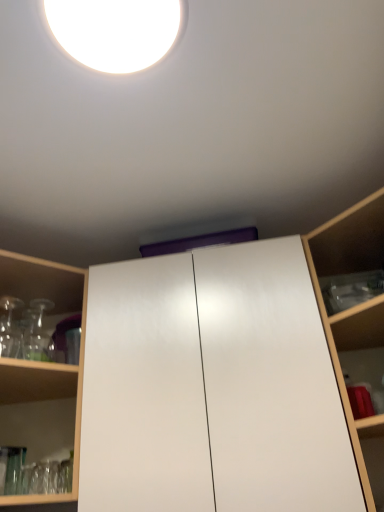
Describe the element at coordinates (115, 31) in the screenshot. I see `white glossy droplight at upper center` at that location.

Where is `wooden shelf at right, the 2th shelf when ordered from left to right`? wooden shelf at right, the 2th shelf when ordered from left to right is located at coordinates (352, 308).

Considering the relative positions of white glossy droplight at upper center and transparent glassware at left, arranged as the first shelf when viewed from the left, in the image provided, is white glossy droplight at upper center to the right of transparent glassware at left, arranged as the first shelf when viewed from the left, from the viewer's perspective?

Indeed, white glossy droplight at upper center is positioned on the right side of transparent glassware at left, arranged as the first shelf when viewed from the left.

Is white glossy droplight at upper center placed right next to transparent glassware at left, arranged as the first shelf when viewed from the left?

No.

In the scene shown: Looking at their sizes, would you say white glossy droplight at upper center is wider or thinner than transparent glassware at left, arranged as the first shelf when viewed from the left?

In the image, white glossy droplight at upper center appears to be more narrow than transparent glassware at left, arranged as the first shelf when viewed from the left.

In the image, is white glossy droplight at upper center positioned in front of or behind transparent glassware at left, the second shelf from the right?

In the image, white glossy droplight at upper center appears in front of transparent glassware at left, the second shelf from the right.

You are a GUI agent. You are given a task and a screenshot of the screen. Output one action in this format:
    pyautogui.click(x=<x>, y=<y>)
    Task: Click on the shelf above the transparent glassware at left, the second shelf from the right (from the image's perspective)
    
    Given the screenshot: What is the action you would take?
    pyautogui.click(x=352, y=308)

Which object is thinner, wooden shelf at right, the 1th shelf from the right, or transparent glassware at left, arranged as the first shelf when viewed from the left?

wooden shelf at right, the 1th shelf from the right, is thinner.

Does wooden shelf at right, the 1th shelf from the right, contain transparent glassware at left, arranged as the first shelf when viewed from the left?

No, wooden shelf at right, the 1th shelf from the right, does not contain transparent glassware at left, arranged as the first shelf when viewed from the left.

Is white glossy cabinet at center looking in the opposite direction of transparent glassware at left, the second shelf from the right?

white glossy cabinet at center does not have its back to transparent glassware at left, the second shelf from the right.

From the image's perspective, which object appears higher, white glossy cabinet at center or transparent glassware at left, the second shelf from the right?

white glossy cabinet at center appears higher in the image.

Is white glossy cabinet at center taller or shorter than transparent glassware at left, the second shelf from the right?

In the image, white glossy cabinet at center appears to be taller than transparent glassware at left, the second shelf from the right.

The height and width of the screenshot is (512, 384). What are the coordinates of `shelf located above the wooden shelf at right, the 1th shelf from the right (from a real-world perspective)` in the screenshot? It's located at (42, 362).

Is transparent glassware at left, the second shelf from the right, oriented away from wooden shelf at right, the 2th shelf when ordered from left to right?

transparent glassware at left, the second shelf from the right, is not turned away from wooden shelf at right, the 2th shelf when ordered from left to right.

Does transparent glassware at left, arranged as the first shelf when viewed from the left, have a greater width compared to wooden shelf at right, the 1th shelf from the right?

Indeed, transparent glassware at left, arranged as the first shelf when viewed from the left, has a greater width compared to wooden shelf at right, the 1th shelf from the right.

From a real-world perspective, relative to white glossy cabinet at center, is transparent glassware at left, the second shelf from the right, vertically above or below?

transparent glassware at left, the second shelf from the right, is above white glossy cabinet at center.

Considering the relative sizes of transparent glassware at left, arranged as the first shelf when viewed from the left, and white glossy cabinet at center in the image provided, is transparent glassware at left, arranged as the first shelf when viewed from the left, bigger than white glossy cabinet at center?

Actually, transparent glassware at left, arranged as the first shelf when viewed from the left, might be smaller than white glossy cabinet at center.

Which of these two, transparent glassware at left, arranged as the first shelf when viewed from the left, or white glossy cabinet at center, is thinner?

With smaller width is white glossy cabinet at center.

Which is farther, [62,308] or [377,218]?

The point [62,308] is farther.

Between white glossy droplight at upper center and wooden shelf at right, the 1th shelf from the right, which one appears on the left side from the viewer's perspective?

From the viewer's perspective, white glossy droplight at upper center appears more on the left side.

Looking at this image, which object is wider, white glossy droplight at upper center or wooden shelf at right, the 1th shelf from the right?

Wider between the two is wooden shelf at right, the 1th shelf from the right.

Is white glossy droplight at upper center inside or outside of wooden shelf at right, the 1th shelf from the right?

white glossy droplight at upper center is not enclosed by wooden shelf at right, the 1th shelf from the right.

From the image's perspective, does transparent glassware at left, arranged as the first shelf when viewed from the left, appear lower than white glossy droplight at upper center?

Yes, from the image's perspective, transparent glassware at left, arranged as the first shelf when viewed from the left, is beneath white glossy droplight at upper center.

From a real-world perspective, is transparent glassware at left, arranged as the first shelf when viewed from the left, above or below white glossy droplight at upper center?

From a real-world perspective, transparent glassware at left, arranged as the first shelf when viewed from the left, is physically below white glossy droplight at upper center.

Who is shorter, transparent glassware at left, arranged as the first shelf when viewed from the left, or white glossy droplight at upper center?

white glossy droplight at upper center is shorter.

This screenshot has width=384, height=512. I want to click on the 2nd shelf behind the white glossy droplight at upper center, starting your count from the anchor, so click(42, 362).

Find the location of a particular element. The width and height of the screenshot is (384, 512). shelf located on the left of wooden shelf at right, the 1th shelf from the right is located at coordinates (42, 362).

Estimate the real-world distances between objects in this image. Which object is further from white glossy droplight at upper center, transparent glassware at left, the second shelf from the right, or wooden shelf at right, the 2th shelf when ordered from left to right?

Among the two, wooden shelf at right, the 2th shelf when ordered from left to right, is located further to white glossy droplight at upper center.

Estimate the real-world distances between objects in this image. Which object is further from wooden shelf at right, the 2th shelf when ordered from left to right, transparent glassware at left, arranged as the first shelf when viewed from the left, or white glossy cabinet at center?

transparent glassware at left, arranged as the first shelf when viewed from the left.

When comparing their distances from transparent glassware at left, the second shelf from the right, does white glossy droplight at upper center or wooden shelf at right, the 2th shelf when ordered from left to right, seem further?

The object further to transparent glassware at left, the second shelf from the right, is white glossy droplight at upper center.

Looking at the image, which one is located further to wooden shelf at right, the 2th shelf when ordered from left to right, white glossy droplight at upper center or transparent glassware at left, arranged as the first shelf when viewed from the left?

white glossy droplight at upper center lies further to wooden shelf at right, the 2th shelf when ordered from left to right, than the other object.

Estimate the real-world distances between objects in this image. Which object is closer to white glossy droplight at upper center, wooden shelf at right, the 1th shelf from the right, or transparent glassware at left, the second shelf from the right?

Among the two, transparent glassware at left, the second shelf from the right, is located nearer to white glossy droplight at upper center.

When comparing their distances from white glossy cabinet at center, does white glossy droplight at upper center or wooden shelf at right, the 2th shelf when ordered from left to right, seem closer?

The object closer to white glossy cabinet at center is wooden shelf at right, the 2th shelf when ordered from left to right.

Looking at this image, from the image, which object appears to be farther from white glossy cabinet at center, wooden shelf at right, the 2th shelf when ordered from left to right, or white glossy droplight at upper center?

white glossy droplight at upper center is further to white glossy cabinet at center.

Estimate the real-world distances between objects in this image. Which object is closer to white glossy droplight at upper center, white glossy cabinet at center or transparent glassware at left, arranged as the first shelf when viewed from the left?

transparent glassware at left, arranged as the first shelf when viewed from the left.

Where is `cabinetry between white glossy droplight at upper center and transparent glassware at left, the second shelf from the right, in the up-down direction`? This screenshot has width=384, height=512. cabinetry between white glossy droplight at upper center and transparent glassware at left, the second shelf from the right, in the up-down direction is located at coordinates (354, 306).

Identify the location of droplight situated between transparent glassware at left, the second shelf from the right, and wooden shelf at right, the 1th shelf from the right, from left to right. [x=115, y=31].

Identify the location of shelf between white glossy droplight at upper center and white glossy cabinet at center in the up-down direction. (352, 308).

The width and height of the screenshot is (384, 512). Identify the location of cabinetry situated between transparent glassware at left, the second shelf from the right, and wooden shelf at right, the 2th shelf when ordered from left to right, from left to right. (354, 306).